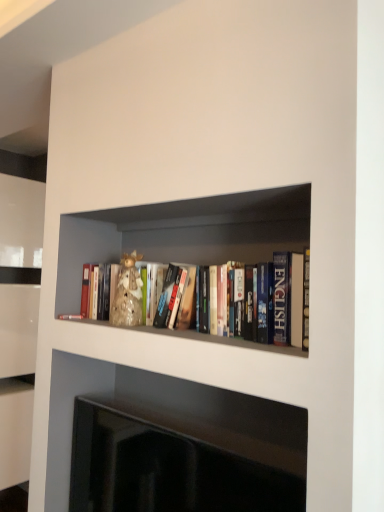
Question: From a real-world perspective, is black glossy fireplace at lower center above or below hardcover books at center?

Choices:
 (A) below
 (B) above

Answer: (A)

Question: Based on their positions, is black glossy fireplace at lower center located to the left or right of hardcover books at center?

Choices:
 (A) right
 (B) left

Answer: (B)

Question: In terms of height, does black glossy fireplace at lower center look taller or shorter compared to hardcover books at center?

Choices:
 (A) tall
 (B) short

Answer: (A)

Question: In terms of width, does hardcover books at center look wider or thinner when compared to black glossy fireplace at lower center?

Choices:
 (A) thin
 (B) wide

Answer: (B)

Question: Is point (235, 307) positioned closer to the camera than point (172, 499)?

Choices:
 (A) farther
 (B) closer

Answer: (B)

Question: Is hardcover books at center to the left or to the right of black glossy fireplace at lower center in the image?

Choices:
 (A) left
 (B) right

Answer: (B)

Question: Is hardcover books at center taller or shorter than black glossy fireplace at lower center?

Choices:
 (A) tall
 (B) short

Answer: (B)